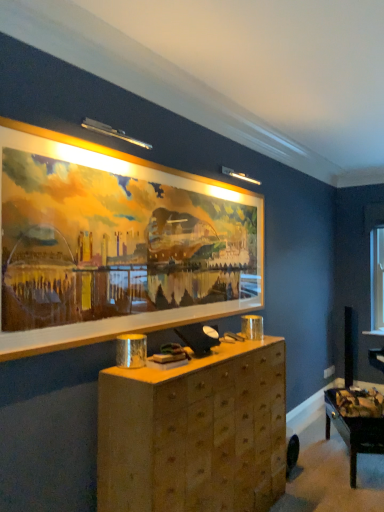
Question: From the image's perspective, is wooden table at lower right beneath wooden picture frame at upper center?

Choices:
 (A) no
 (B) yes

Answer: (B)

Question: Does wooden table at lower right touch wooden picture frame at upper center?

Choices:
 (A) no
 (B) yes

Answer: (A)

Question: Is wooden table at lower right bigger than wooden picture frame at upper center?

Choices:
 (A) yes
 (B) no

Answer: (A)

Question: Can you confirm if wooden table at lower right is smaller than wooden picture frame at upper center?

Choices:
 (A) yes
 (B) no

Answer: (B)

Question: Is wooden picture frame at upper center surrounded by wooden table at lower right?

Choices:
 (A) yes
 (B) no

Answer: (B)

Question: Is wooden table at lower right not close to wooden picture frame at upper center?

Choices:
 (A) no
 (B) yes

Answer: (B)

Question: Is the depth of wooden table at lower right greater than that of wooden chest of drawers at center?

Choices:
 (A) yes
 (B) no

Answer: (A)

Question: From a real-world perspective, is wooden table at lower right under wooden chest of drawers at center?

Choices:
 (A) yes
 (B) no

Answer: (A)

Question: Can you confirm if wooden table at lower right is thinner than wooden chest of drawers at center?

Choices:
 (A) no
 (B) yes

Answer: (B)

Question: Could you tell me if wooden table at lower right is facing wooden chest of drawers at center?

Choices:
 (A) yes
 (B) no

Answer: (B)

Question: Can you confirm if wooden table at lower right is taller than wooden chest of drawers at center?

Choices:
 (A) no
 (B) yes

Answer: (A)

Question: From the image's perspective, is wooden table at lower right under wooden chest of drawers at center?

Choices:
 (A) yes
 (B) no

Answer: (A)

Question: Is wooden chest of drawers at center thinner than wooden picture frame at upper center?

Choices:
 (A) yes
 (B) no

Answer: (B)